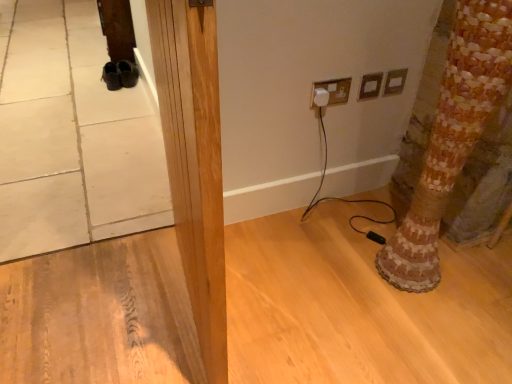
Find the location of a particular element. free space to the left of natural wood pillar at center is located at coordinates (108, 303).